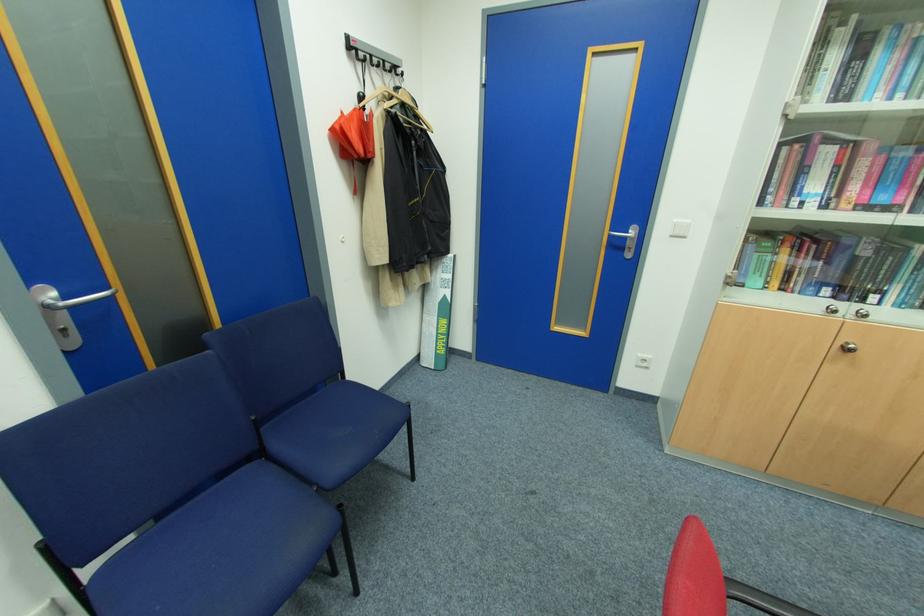
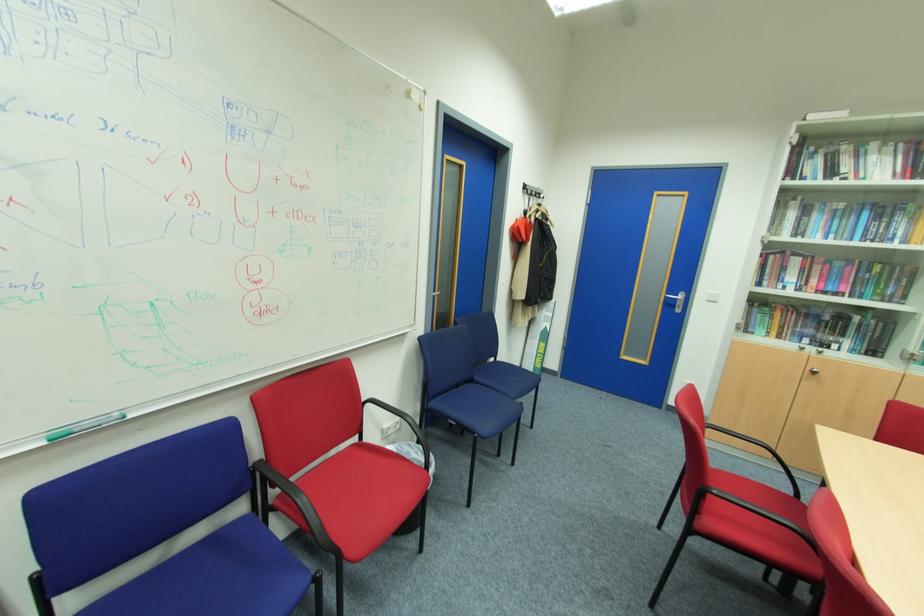
Question: I am providing you with two images of the same scene from different viewpoints. Which of the following objects are not visible in image2?

Choices:
 (A) white light switch
 (B) black chair armrest
 (C) book on shelf
 (D) none of these

Answer: (D)